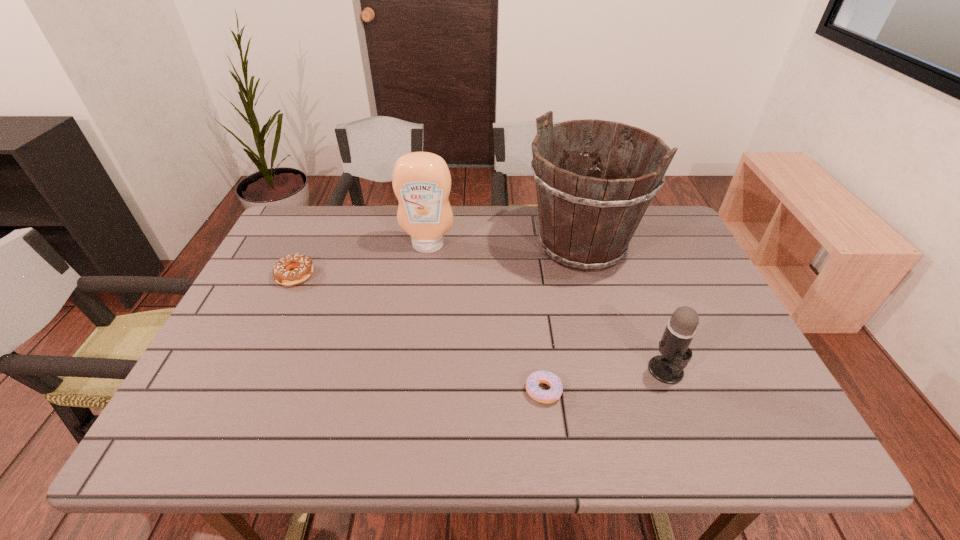
Identify the location of free point at the left edge. This screenshot has width=960, height=540. (253, 382).

What are the coordinates of `vacant space at the right edge of the desktop` in the screenshot? It's located at (691, 292).

In the image, there is a desktop. Where is `vacant space at the far left corner`? vacant space at the far left corner is located at coordinates (283, 233).

Where is `blank space at the far right corner of the desktop`? The image size is (960, 540). blank space at the far right corner of the desktop is located at coordinates (675, 230).

Where is `free area in between the second object from left to right and the tallest object`? The height and width of the screenshot is (540, 960). free area in between the second object from left to right and the tallest object is located at coordinates (505, 246).

This screenshot has width=960, height=540. What are the coordinates of `free space between the third tallest object and the condiment` in the screenshot? It's located at pos(547,308).

Where is `blank region between the bucket and the left doughnut`? The height and width of the screenshot is (540, 960). blank region between the bucket and the left doughnut is located at coordinates (439, 261).

The image size is (960, 540). In order to click on free space that is in between the farther doughnut and the tallest object in this screenshot , I will do `click(439, 261)`.

I want to click on empty space that is in between the microphone and the farther doughnut, so (x=481, y=323).

This screenshot has width=960, height=540. Find the location of `vacant space in between the third shortest object and the bucket`. vacant space in between the third shortest object and the bucket is located at coordinates (624, 308).